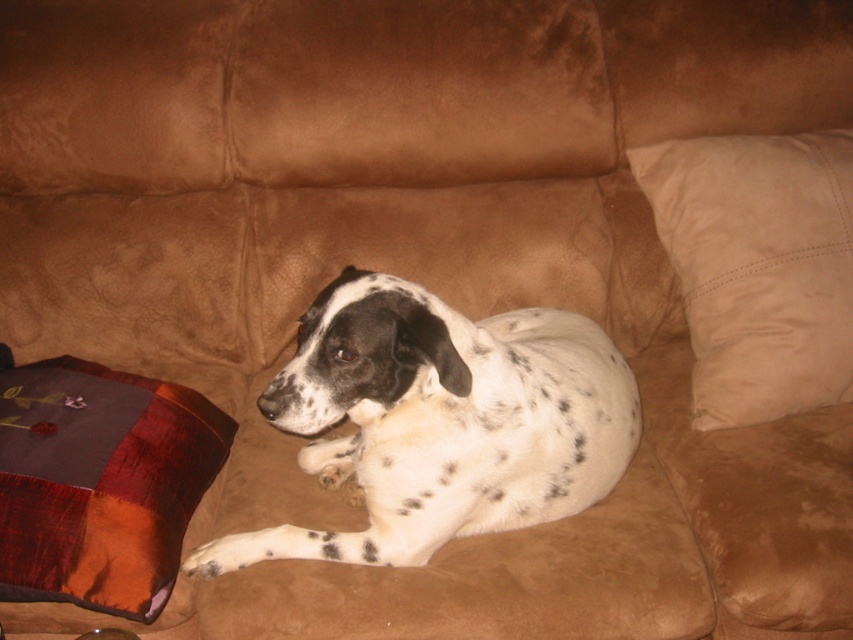
You are a photographer standing at the camera position. You want to place the beige suede pillow at right closer to the camera so that it is only 1 meter away. Is this possible without moving the dog?

The beige suede pillow at right and camera are currently 1.45 meters apart. To move the pillow closer to the camera to 1 meter away, you would need to adjust its position by 0.45 meters. Since the question specifies not moving the dog, it depends on whether there is enough space between the pillow and the dog to make this adjustment. However, the provided information does not mention the dog obstructing the pillow or the distance between the pillow and the dog. Assuming the pillow can be moved independently